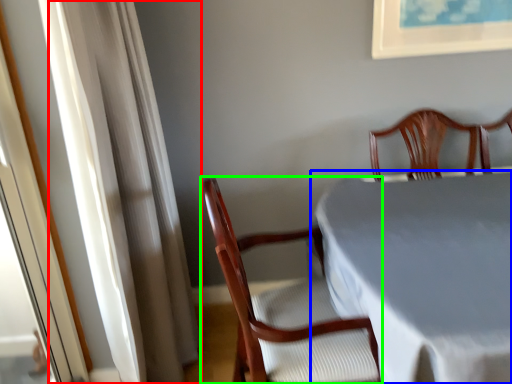
Question: Which object is positioned closest to curtain (highlighted by a red box)? Select from table (highlighted by a blue box) and chair (highlighted by a green box).

Choices:
 (A) table
 (B) chair

Answer: (B)